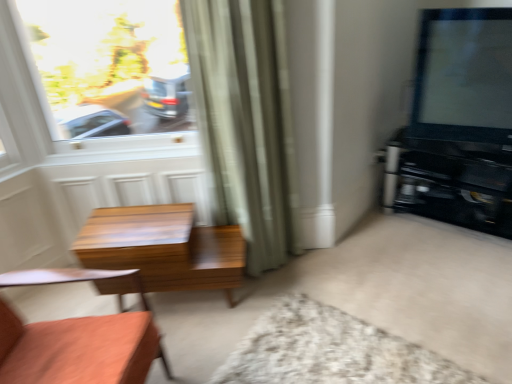
Question: Does white shaggy rug at lower center contain wooden table at center?

Choices:
 (A) yes
 (B) no

Answer: (B)

Question: Is white shaggy rug at lower center not near wooden table at center?

Choices:
 (A) yes
 (B) no

Answer: (B)

Question: Is white shaggy rug at lower center directly adjacent to wooden table at center?

Choices:
 (A) no
 (B) yes

Answer: (A)

Question: Is white shaggy rug at lower center outside of wooden table at center?

Choices:
 (A) yes
 (B) no

Answer: (A)

Question: Is white shaggy rug at lower center smaller than wooden table at center?

Choices:
 (A) yes
 (B) no

Answer: (A)

Question: Is wooden table at center at the back of white shaggy rug at lower center?

Choices:
 (A) yes
 (B) no

Answer: (B)

Question: Can you confirm if wooden chair at lower left is positioned to the right of matte black tv at upper right?

Choices:
 (A) no
 (B) yes

Answer: (A)

Question: From the image's perspective, is wooden chair at lower left above matte black tv at upper right?

Choices:
 (A) no
 (B) yes

Answer: (A)

Question: Can you confirm if wooden chair at lower left is shorter than matte black tv at upper right?

Choices:
 (A) yes
 (B) no

Answer: (B)

Question: From a real-world perspective, is wooden chair at lower left physically below matte black tv at upper right?

Choices:
 (A) yes
 (B) no

Answer: (A)

Question: Is the position of wooden chair at lower left less distant than that of matte black tv at upper right?

Choices:
 (A) yes
 (B) no

Answer: (A)

Question: Is matte black tv at upper right at the back of wooden chair at lower left?

Choices:
 (A) yes
 (B) no

Answer: (B)

Question: Does clear glass window at upper left have a lesser width compared to white shaggy rug at lower center?

Choices:
 (A) yes
 (B) no

Answer: (A)